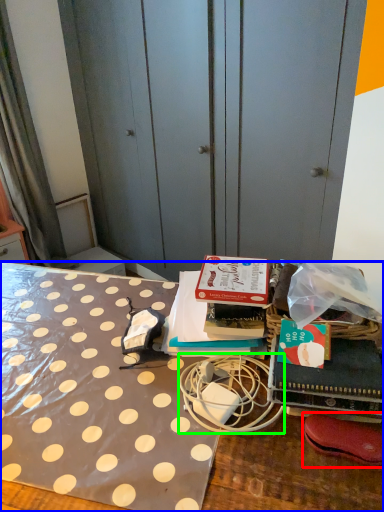
Question: Estimate the real-world distances between objects in this image. Which object is farther from footwear (highlighted by a red box), desk (highlighted by a blue box) or twin (highlighted by a green box)?

Choices:
 (A) desk
 (B) twin

Answer: (A)